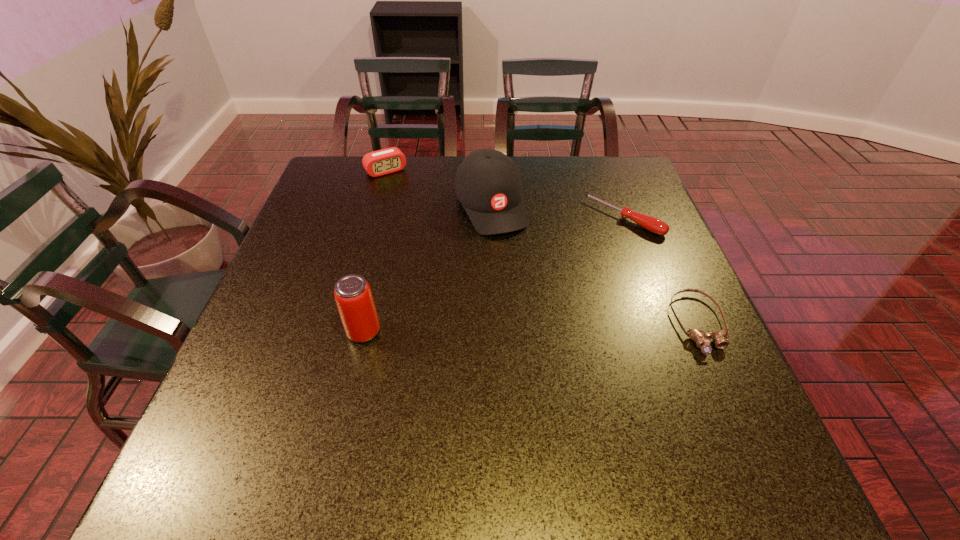
Find the location of a particular element. The width and height of the screenshot is (960, 540). free space located at the tip of the fourth tallest object is located at coordinates (542, 289).

Image resolution: width=960 pixels, height=540 pixels. Find the location of `vacant region located at the tip of the fourth tallest object`. vacant region located at the tip of the fourth tallest object is located at coordinates (529, 301).

The height and width of the screenshot is (540, 960). In order to click on vacant space located 0.180m at the tip of the fourth tallest object in this screenshot , I will do point(564,269).

Locate an element on the screen. The height and width of the screenshot is (540, 960). free location located on the front-facing side of the third tallest object is located at coordinates click(x=411, y=202).

This screenshot has height=540, width=960. What are the coordinates of `vacant space located 0.250m on the front-facing side of the third tallest object` in the screenshot? It's located at (426, 224).

At what (x,y) coordinates should I click in order to perform the action: click on vacant region located on the front-facing side of the third tallest object. Please return your answer as a coordinate pair (x, y). Looking at the image, I should click on 420,215.

The height and width of the screenshot is (540, 960). What are the coordinates of `baseball cap that is at the far edge` in the screenshot? It's located at (488, 184).

The height and width of the screenshot is (540, 960). What are the coordinates of `screwdriver positioned at the far edge` in the screenshot? It's located at (652, 224).

Image resolution: width=960 pixels, height=540 pixels. Identify the location of alarm clock that is at the far edge. (389, 160).

Where is `object that is at the left edge`? Image resolution: width=960 pixels, height=540 pixels. object that is at the left edge is located at coordinates (389, 160).